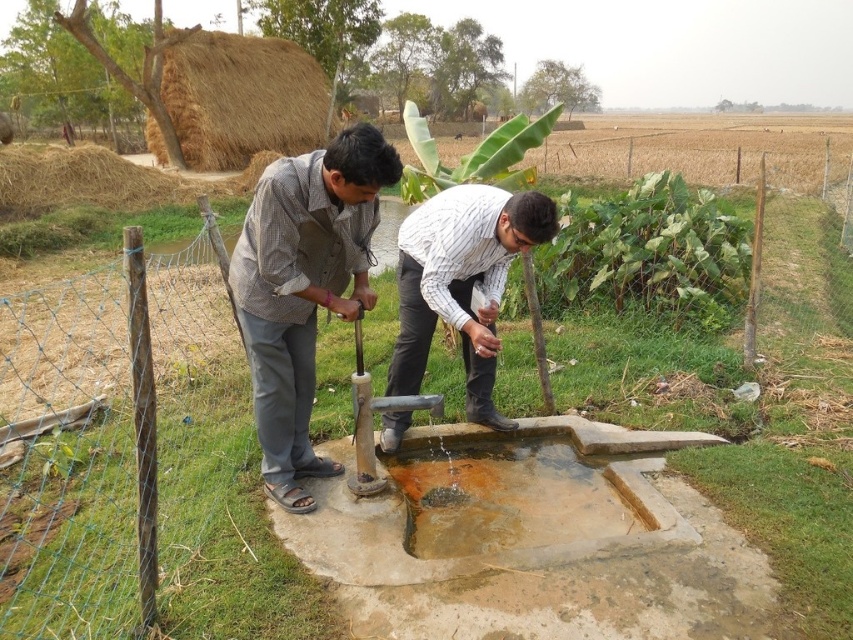
You are a farmer working near the water pump. You need to step over the brown concrete puddle at center to reach the matte gray shirt at center. Is the puddle in your path?

The matte gray shirt at center is in front of the brown concrete puddle at center, so stepping over the puddle would not be necessary to reach the matte gray shirt at center.